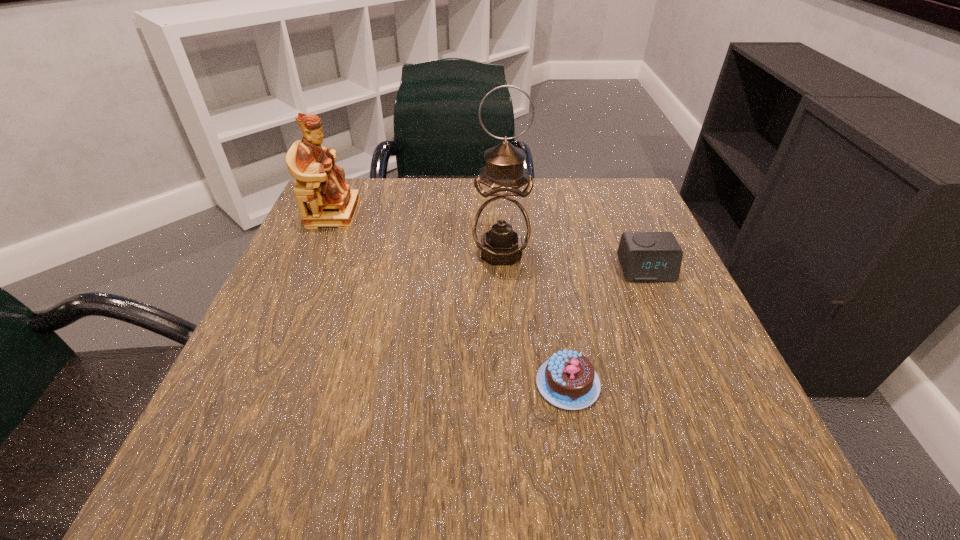
Identify the location of free region that satisfies the following two spatial constraints: 1. on the front-facing side of the leftmost object; 2. on the left side of the shortest object. The height and width of the screenshot is (540, 960). (258, 383).